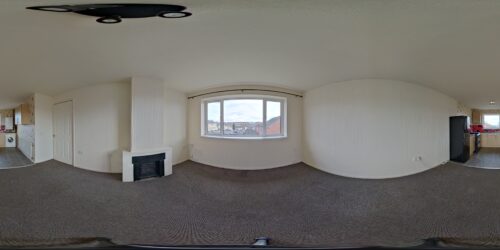
Find the location of `washing machine`. washing machine is located at coordinates (8, 135).